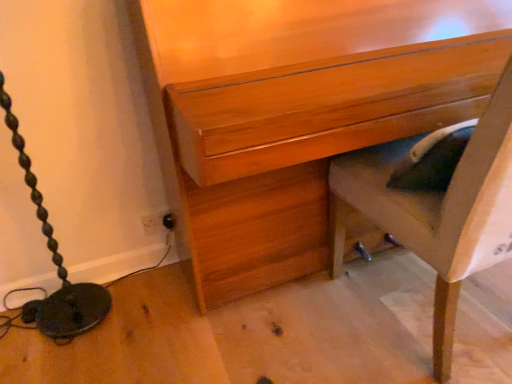
Image resolution: width=512 pixels, height=384 pixels. Identify the location of vacant space underneath wooden chair at lower right (from a real-world perspective). pyautogui.click(x=456, y=322).